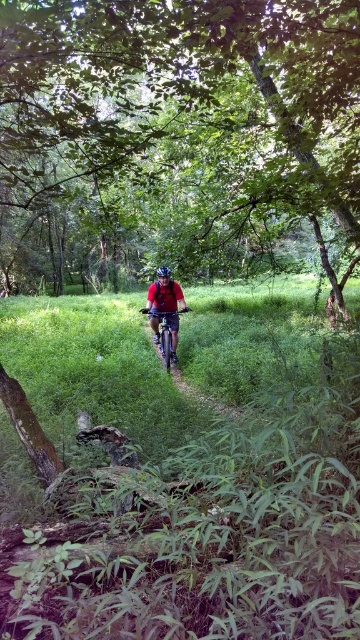
Question: Which object is closer to the camera taking this photo?

Choices:
 (A) green leafy tree at center
 (B) blue matte helmet at center
 (C) metallic silver bicycle at center

Answer: (A)

Question: Based on their relative distances, which object is nearer to the green leafy tree at center?

Choices:
 (A) matte red shirt at center
 (B) metallic silver bicycle at center
 (C) blue matte helmet at center

Answer: (B)

Question: Does green leafy tree at center have a smaller size compared to metallic silver bicycle at center?

Choices:
 (A) yes
 (B) no

Answer: (B)

Question: Which of the following is the farthest from the observer?

Choices:
 (A) blue matte helmet at center
 (B) matte red shirt at center
 (C) metallic silver bicycle at center
 (D) green leafy tree at center

Answer: (A)

Question: Does green leafy tree at center appear on the right side of metallic silver bicycle at center?

Choices:
 (A) yes
 (B) no

Answer: (B)

Question: Does metallic silver bicycle at center appear on the left side of blue matte helmet at center?

Choices:
 (A) yes
 (B) no

Answer: (B)